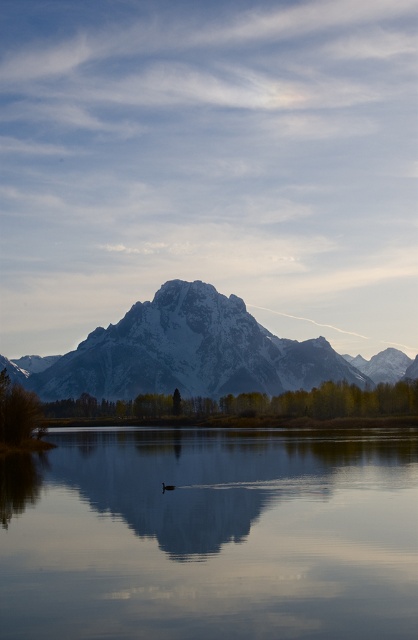
You are an ornithologist observing the scene. You need to determine the relative sizes of the objects in the image. Which object takes up more space in the image, the smooth glass water at center or the brown matte duck at center?

The smooth glass water at center is larger in size than the brown matte duck at center, so the smooth glass water at center takes up more space in the image.

You are a photographer trying to capture the reflection of the mountains in the smooth glass water at center. However, you notice the brown matte duck at center is blocking the view. Can you determine if the duck is taller or shorter than the water surface?

The smooth glass water at center is much taller than the brown matte duck at center, so the duck is shorter than the water surface. Therefore, the duck is blocking the reflection but is not tall enough to obscure the entire view.

You are standing at the point marked as point (191, 353) in the image. What can you see directly in front of you?

You can see the white snow covered mountain range at center directly in front of you at point (191, 353).